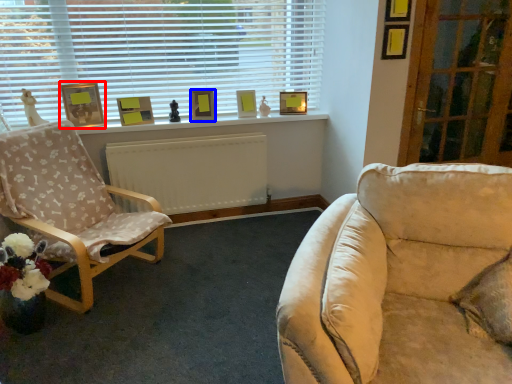
Question: Which object is further to the camera taking this photo, picture frame (highlighted by a red box) or picture frame (highlighted by a blue box)?

Choices:
 (A) picture frame
 (B) picture frame

Answer: (B)